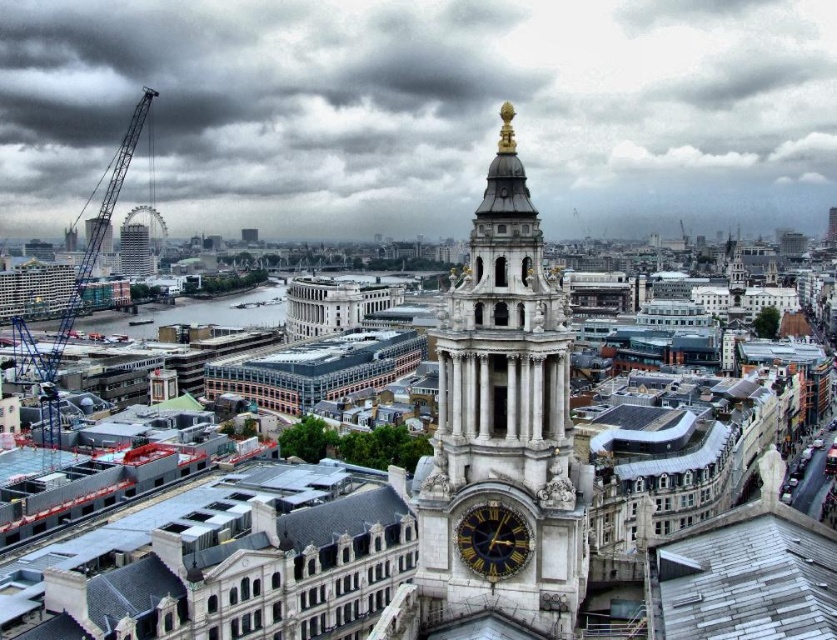
Does white stone clock tower at center appear under gold-toned metal clock at center-right?

No, white stone clock tower at center is not below gold-toned metal clock at center-right.

Consider the image. Can you confirm if white stone clock tower at center is positioned to the right of gold-toned metal clock at center-right?

No, white stone clock tower at center is not to the right of gold-toned metal clock at center-right.

Which is in front, point (420, 554) or point (507, 576)?

Point (507, 576) is more forward.

The width and height of the screenshot is (837, 640). I want to click on white stone clock tower at center, so click(x=502, y=433).

Is point (60, 324) positioned before point (147, 248)?

Yes, point (60, 324) is closer to viewer.

Consider the image. Does blue metallic crane at left have a greater height compared to matte gray skyscraper at left?

Yes, blue metallic crane at left is taller than matte gray skyscraper at left.

Image resolution: width=837 pixels, height=640 pixels. Identify the location of blue metallic crane at left. (75, 291).

Does point (567, 364) come farther from viewer compared to point (149, 268)?

No, (567, 364) is in front of (149, 268).

Looking at this image, is white stone clock tower at center to the left of matte gray skyscraper at left from the viewer's perspective?

No, white stone clock tower at center is not to the left of matte gray skyscraper at left.

Locate an element on the screen. The width and height of the screenshot is (837, 640). white stone clock tower at center is located at coordinates (502, 433).